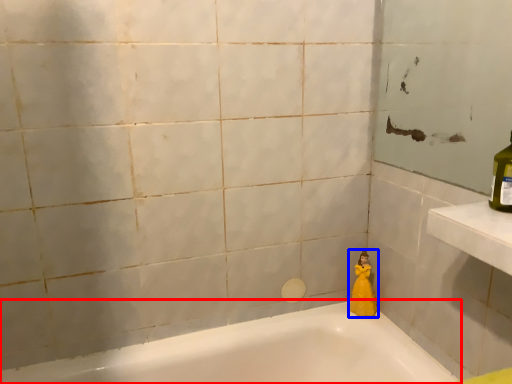
Question: Which object appears farthest to the camera in this image, bathtub (highlighted by a red box) or doll (highlighted by a blue box)?

Choices:
 (A) bathtub
 (B) doll

Answer: (B)